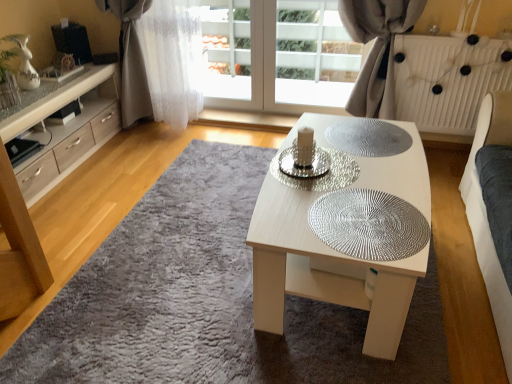
Locate an element on the screen. The width and height of the screenshot is (512, 384). vacant area that lies between silver textured glass plate at center, arranged as the 3th glass plate when viewed from the back, and silver textured glass plate at center, the 2th glass plate in the front-to-back sequence is located at coordinates (319, 198).